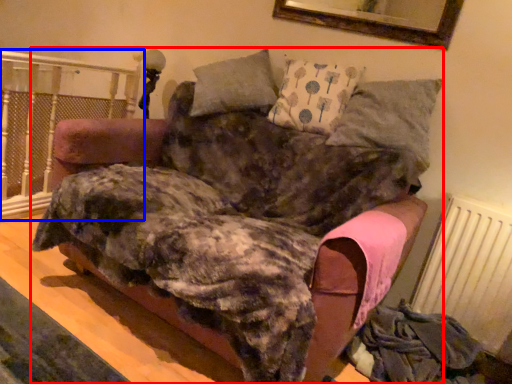
Question: Which object appears farthest to the camera in this image, furniture (highlighted by a red box) or rail (highlighted by a blue box)?

Choices:
 (A) furniture
 (B) rail

Answer: (B)